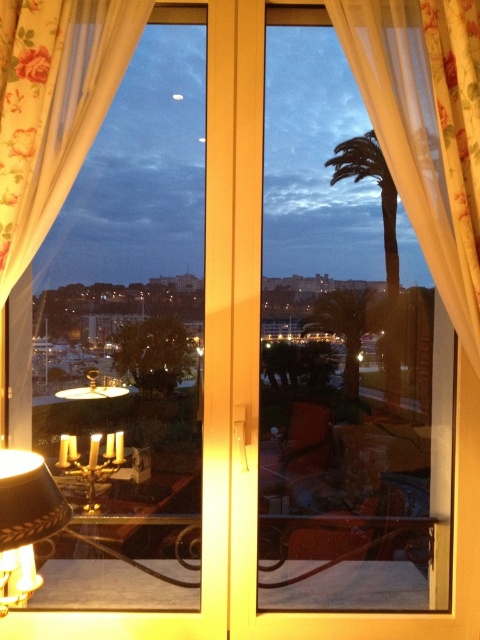
Is floral fabric curtain at upper left to the left of green leafy palm tree at center from the viewer's perspective?

Indeed, floral fabric curtain at upper left is positioned on the left side of green leafy palm tree at center.

Where is `floral fabric curtain at upper left`? The height and width of the screenshot is (640, 480). floral fabric curtain at upper left is located at coordinates (52, 108).

Does point (435, 58) lie behind point (1, 241)?

No, (435, 58) is in front of (1, 241).

Describe the element at coordinates (427, 129) in the screenshot. I see `floral fabric curtain at right` at that location.

At what (x,y) coordinates should I click in order to perform the action: click on floral fabric curtain at right. Please return your answer as a coordinate pair (x, y). This screenshot has width=480, height=640. Looking at the image, I should click on (427, 129).

This screenshot has width=480, height=640. What do you see at coordinates (427, 129) in the screenshot?
I see `floral fabric curtain at right` at bounding box center [427, 129].

Looking at this image, does floral fabric curtain at right come in front of green leafy palm tree at center?

Yes, floral fabric curtain at right is closer to the viewer.

Where is `floral fabric curtain at right`? The height and width of the screenshot is (640, 480). floral fabric curtain at right is located at coordinates (427, 129).